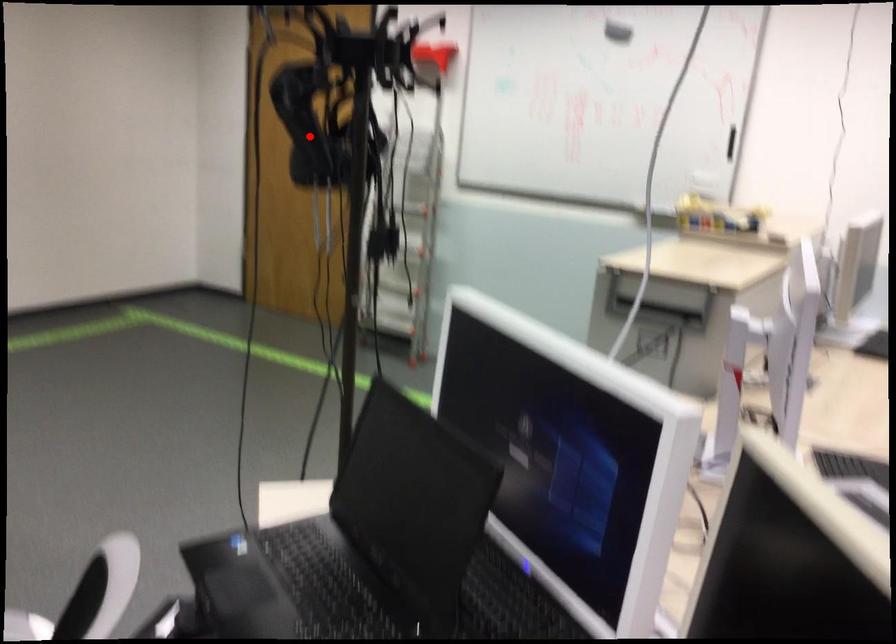
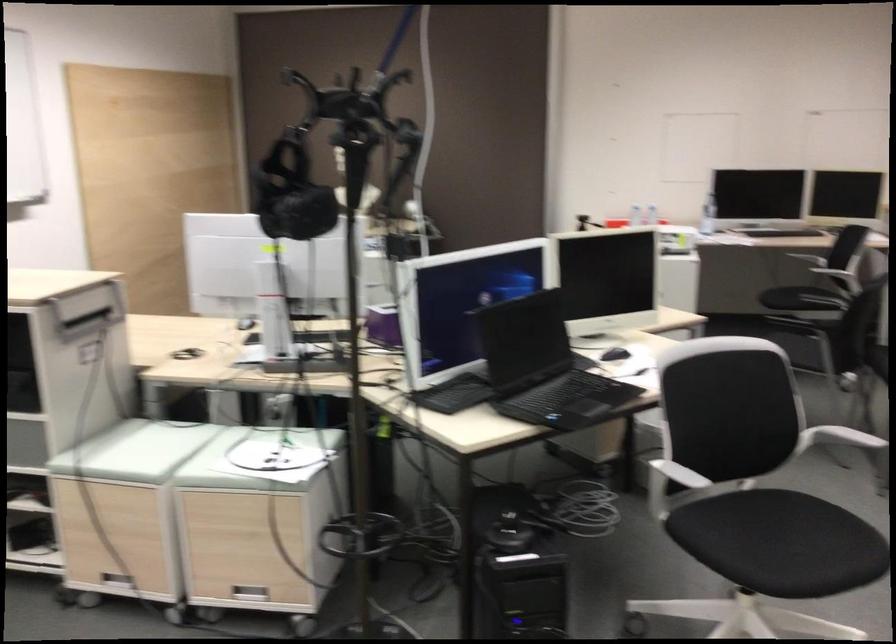
Question: I am providing you with two images of the same scene from different viewpoints. Image1 has a red point marked. In image2, the corresponding 3D location appears at what relative position? Reply with the corresponding letter.

Choices:
 (A) Closer
 (B) Farther

Answer: (B)